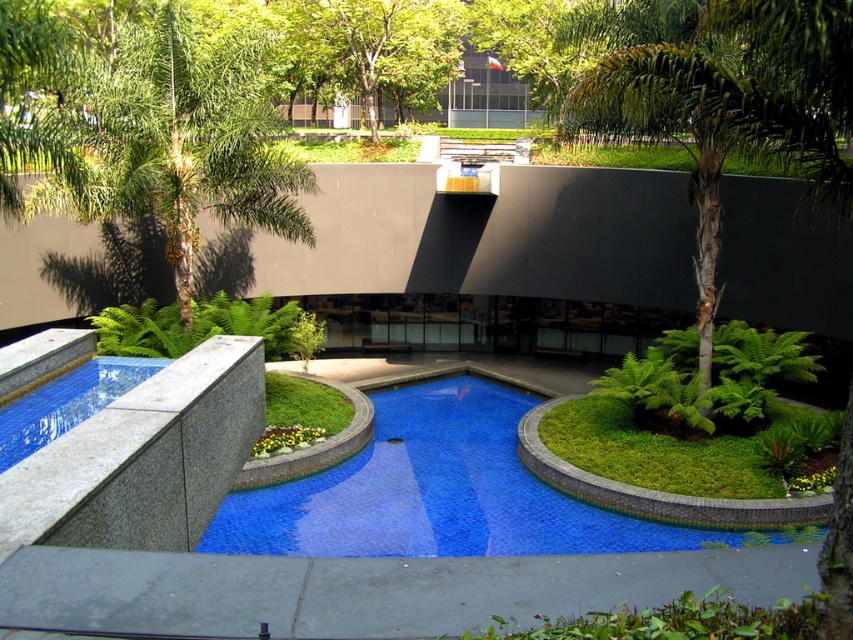
Between blue glossy pool at center and smooth concrete edge at lower left, which one has more height?

blue glossy pool at center

Where is `blue glossy pool at center`? The image size is (853, 640). blue glossy pool at center is located at coordinates (434, 492).

The height and width of the screenshot is (640, 853). Describe the element at coordinates (434, 492) in the screenshot. I see `blue glossy pool at center` at that location.

Identify the location of blue glossy pool at center. (434, 492).

Between green leafy palm tree at left and smooth concrete edge at lower left, which one is positioned lower?

smooth concrete edge at lower left

Does green leafy palm tree at left come behind smooth concrete edge at lower left?

Yes.

Measure the distance between green leafy palm tree at left and camera.

green leafy palm tree at left and camera are 15.87 meters apart.

At what (x,y) coordinates should I click in order to perform the action: click on green leafy palm tree at left. Please return your answer as a coordinate pair (x, y). The height and width of the screenshot is (640, 853). Looking at the image, I should click on (177, 140).

Does green leafy tree at upper center appear on the right side of smooth concrete edge at lower left?

Correct, you'll find green leafy tree at upper center to the right of smooth concrete edge at lower left.

Who is taller, green leafy tree at upper center or smooth concrete edge at lower left?

Standing taller between the two is green leafy tree at upper center.

Between point (321, 19) and point (82, 417), which one is positioned behind?

Positioned behind is point (321, 19).

The height and width of the screenshot is (640, 853). Identify the location of green leafy tree at upper center. (387, 48).